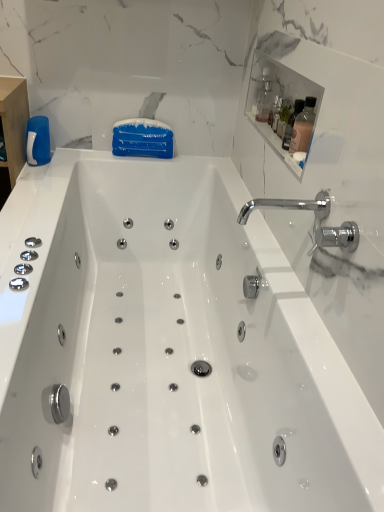
Question: Is chrome/metallic faucet at upper right located outside clear glass bottle at upper right, which is the 1th bottle from top to bottom?

Choices:
 (A) no
 (B) yes

Answer: (B)

Question: Considering the relative sizes of chrome/metallic faucet at upper right and clear glass bottle at upper right, which is the 1th bottle from top to bottom, in the image provided, is chrome/metallic faucet at upper right shorter than clear glass bottle at upper right, which is the 1th bottle from top to bottom,?

Choices:
 (A) yes
 (B) no

Answer: (A)

Question: From a real-world perspective, is chrome/metallic faucet at upper right below clear glass bottle at upper right, the first bottle when ordered from back to front?

Choices:
 (A) yes
 (B) no

Answer: (A)

Question: Are chrome/metallic faucet at upper right and clear glass bottle at upper right, which is the 1th bottle from top to bottom, located far from each other?

Choices:
 (A) no
 (B) yes

Answer: (A)

Question: Is chrome/metallic faucet at upper right wider than clear glass bottle at upper right, which ranks as the 2th bottle in front-to-back order?

Choices:
 (A) yes
 (B) no

Answer: (A)

Question: Looking at their shapes, would you say chrome/metallic faucet at upper right is wider or thinner than white glossy medicine cabinet at upper right?

Choices:
 (A) wide
 (B) thin

Answer: (A)

Question: From a real-world perspective, is chrome/metallic faucet at upper right positioned above or below white glossy medicine cabinet at upper right?

Choices:
 (A) above
 (B) below

Answer: (B)

Question: Based on their positions, is chrome/metallic faucet at upper right located to the left or right of white glossy medicine cabinet at upper right?

Choices:
 (A) right
 (B) left

Answer: (B)

Question: From their relative heights in the image, would you say chrome/metallic faucet at upper right is taller or shorter than white glossy medicine cabinet at upper right?

Choices:
 (A) short
 (B) tall

Answer: (B)

Question: Choose the correct answer: Is chrome/metallic faucet at upper right inside clear glass bottle at upper right, which is the 1th bottle from top to bottom, or outside it?

Choices:
 (A) outside
 (B) inside

Answer: (A)

Question: From a real-world perspective, is chrome/metallic faucet at upper right physically located above or below clear glass bottle at upper right, which is the 1th bottle from top to bottom?

Choices:
 (A) below
 (B) above

Answer: (A)

Question: In the image, is chrome/metallic faucet at upper right on the left side or the right side of clear glass bottle at upper right, which ranks as the 2th bottle in front-to-back order?

Choices:
 (A) right
 (B) left

Answer: (B)

Question: Is chrome/metallic faucet at upper right taller or shorter than clear glass bottle at upper right, the 2th bottle from the bottom?

Choices:
 (A) tall
 (B) short

Answer: (B)

Question: Is white glossy medicine cabinet at upper right situated inside white glossy bathtub at center or outside?

Choices:
 (A) outside
 (B) inside

Answer: (A)

Question: Considering their positions, is white glossy medicine cabinet at upper right located in front of or behind white glossy bathtub at center?

Choices:
 (A) behind
 (B) front

Answer: (A)